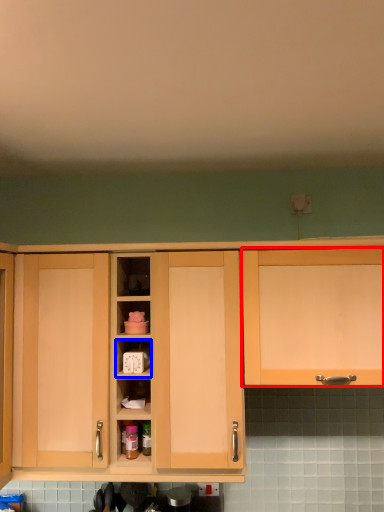
Question: Among these objects, which one is nearest to the camera, cabinetry (highlighted by a red box) or cabinet (highlighted by a blue box)?

Choices:
 (A) cabinetry
 (B) cabinet

Answer: (A)